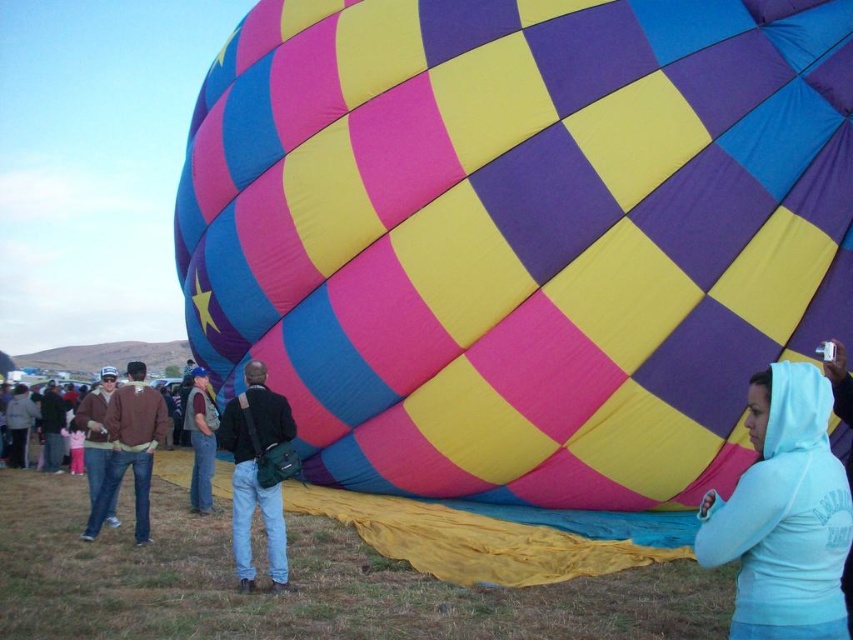
Question: From the image, what is the correct spatial relationship of dark blue leather jacket at center in relation to denim jacket at center?

Choices:
 (A) below
 (B) above

Answer: (B)

Question: Considering the real-world distances, which object is farthest from the dark blue leather jacket at center?

Choices:
 (A) light blue hoodie at lower right
 (B) denim jacket at center

Answer: (A)

Question: Which object is farther from the camera taking this photo?

Choices:
 (A) light blue hoodie at lower right
 (B) checkered fabric balloon at center
 (C) denim jacket at center
 (D) dark blue leather jacket at center

Answer: (C)

Question: Does light blue hoodie at lower right come in front of dark blue leather jacket at center?

Choices:
 (A) yes
 (B) no

Answer: (A)

Question: Is checkered fabric balloon at center wider than light blue hoodie at lower right?

Choices:
 (A) no
 (B) yes

Answer: (B)

Question: Which point appears closest to the camera in this image?

Choices:
 (A) (407, 340)
 (B) (233, 397)
 (C) (199, 433)

Answer: (A)